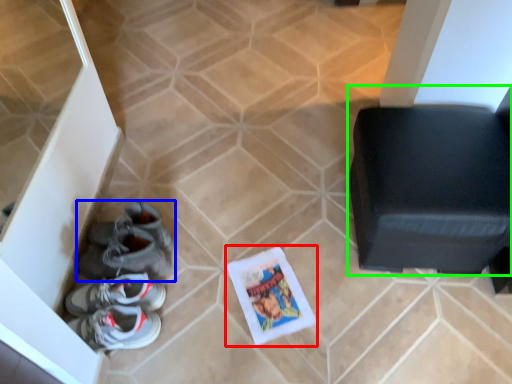
Question: Based on their relative distances, which object is nearer to comic book (highlighted by a red box)? Choose from footwear (highlighted by a blue box) and furniture (highlighted by a green box).

Choices:
 (A) footwear
 (B) furniture

Answer: (A)